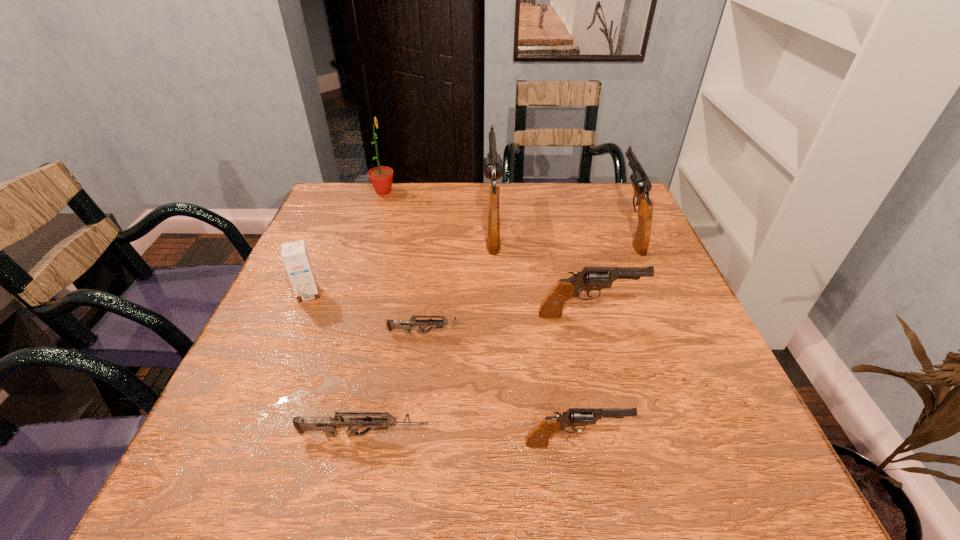
The height and width of the screenshot is (540, 960). Identify the location of free space located aimed along the barrel of the seventh tallest object. (466, 435).

Find the location of a particular element. The height and width of the screenshot is (540, 960). free space located aimed along the barrel of the shortest gun is located at coordinates (545, 333).

The width and height of the screenshot is (960, 540). In order to click on sunflower that is at the far edge in this screenshot , I will do [381, 178].

You are a GUI agent. You are given a task and a screenshot of the screen. Output one action in this format:
    pyautogui.click(x=<x>, y=<y>)
    Task: Click on the object present at the near edge
    Image resolution: width=960 pixels, height=540 pixels.
    Given the screenshot: What is the action you would take?
    pyautogui.click(x=538, y=438)

Where is `sunflower that is at the left edge`? This screenshot has width=960, height=540. sunflower that is at the left edge is located at coordinates (381, 178).

The height and width of the screenshot is (540, 960). In order to click on chocolate milk located in the left edge section of the desktop in this screenshot , I will do `click(294, 254)`.

Identify the location of gun that is at the left edge. (328, 425).

I want to click on object that is at the far left corner, so click(x=381, y=178).

This screenshot has height=540, width=960. I want to click on object at the far right corner, so click(641, 184).

Where is `vacant space at the far edge of the desktop`? This screenshot has width=960, height=540. vacant space at the far edge of the desktop is located at coordinates (445, 208).